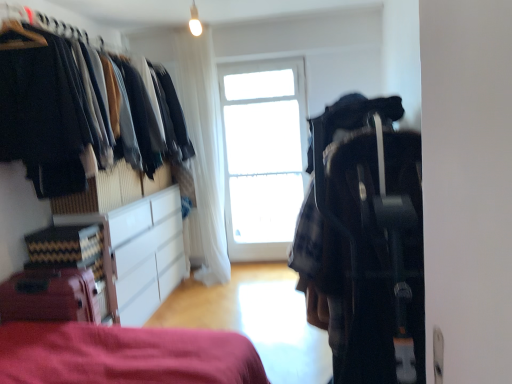
Question: From a real-world perspective, is matte black clothes at left positioned above or below plaid fabric backpack at center right?

Choices:
 (A) above
 (B) below

Answer: (A)

Question: Is matte black clothes at left spatially inside plaid fabric backpack at center right, or outside of it?

Choices:
 (A) inside
 (B) outside

Answer: (B)

Question: Based on their relative distances, which object is farther from the white glossy cabinet at lower left?

Choices:
 (A) matte red suitcase at lower left
 (B) transparent glass window at center
 (C) matte black clothes at left
 (D) white sheer curtain at center
 (E) plaid fabric backpack at center right

Answer: (E)

Question: Which of these objects is positioned closest to the white glossy cabinet at lower left?

Choices:
 (A) matte red suitcase at lower left
 (B) matte black clothes at left
 (C) transparent glass window at center
 (D) plaid fabric backpack at center right
 (E) white sheer curtain at center

Answer: (B)